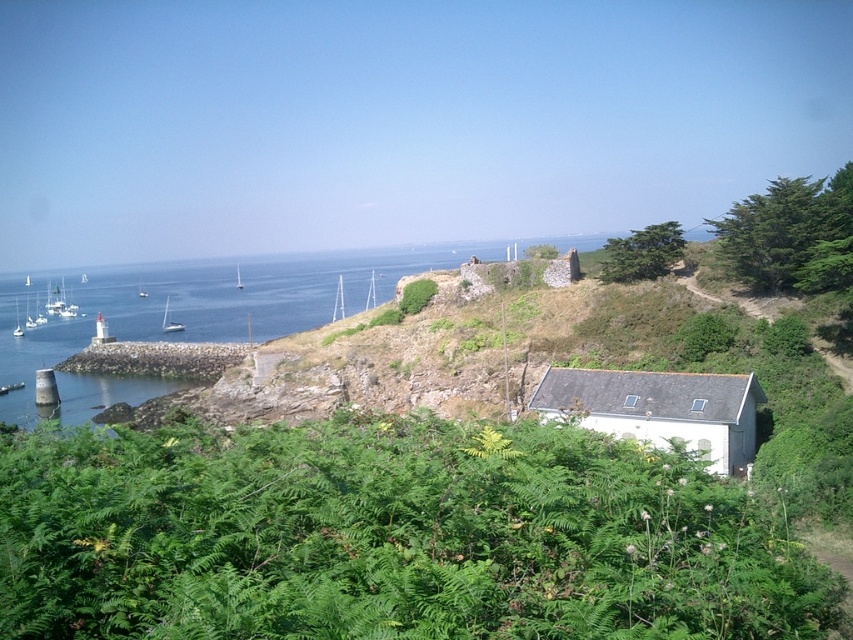
You are a landscape architect designing a walking path between the small white building with a dark gray roof and the rocky outcrop. The path must be straight and pass through the green leafy shrubs at lower center. What is the minimum width required for the path to ensure it can be constructed without disturbing the shrubs?

The green leafy shrubs at lower center are 6.84 meters apart, so the path must be at least 6.84 meters wide to pass through them without disturbance.

You are a photographer planning to take a photo of the white matte cottage at center and the white plastic sailboat at center in the coastal landscape. You want to ensure both subjects are in focus. Given that your camera has a depth of field that can cover 160 meters, will both objects be in focus in the photo?

The white matte cottage at center and the white plastic sailboat at center are 159.78 meters apart from each other. Since the camera can cover 160 meters, both objects will be in focus as their distance is within the depth of field range.